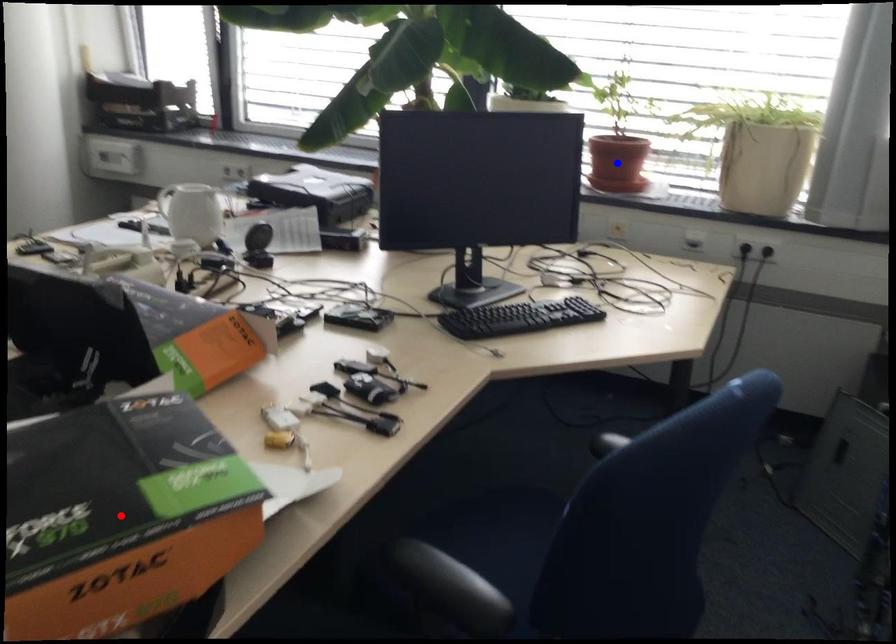
Question: In the image, two points are highlighted. Which point is nearer to the camera? Reply with the corresponding letter.

Choices:
 (A) blue point
 (B) red point

Answer: (B)